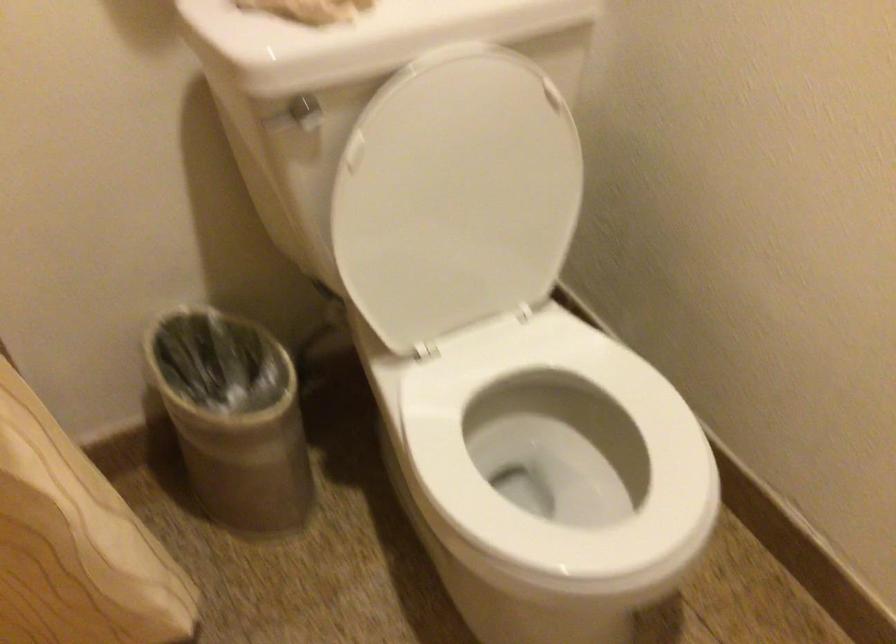
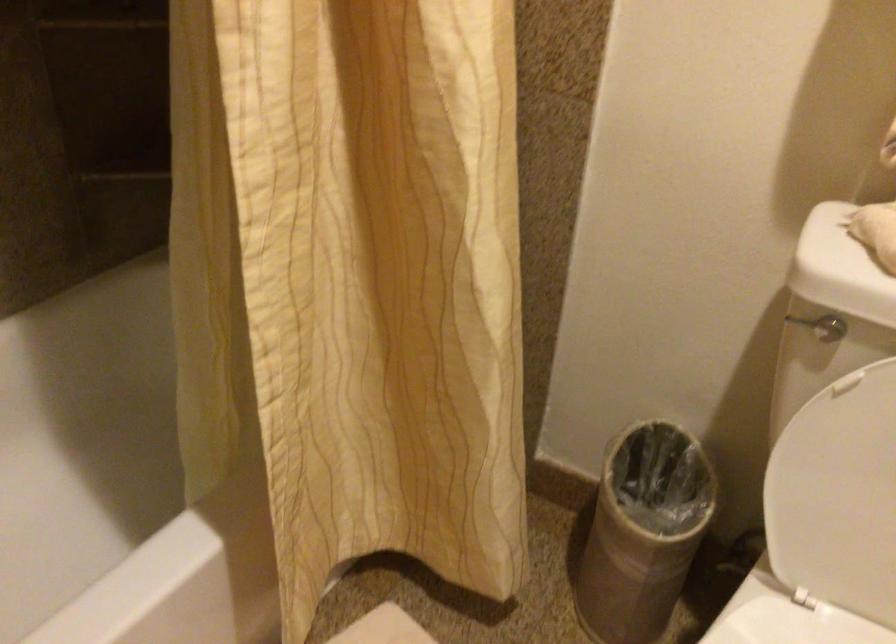
Question: The first image is from the beginning of the video and the second image is from the end. How did the camera likely rotate when shooting the video?

Choices:
 (A) Left
 (B) Right
 (C) Up
 (D) Down

Answer: (A)